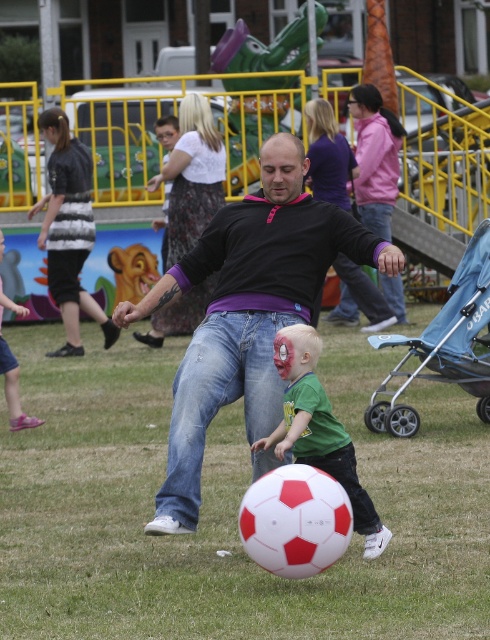
You are standing at the location of the viewer. You want to throw a frisbee to a friend who is standing at the location of the matte black shirt at center. The frisbee can travel up to 8 meters. Will it reach your friend?

The matte black shirt at center and viewer are 7.51 meters apart from each other. Since the frisbee can travel up to 8 meters, it will reach your friend.

You are a photographer trying to capture a photo of the matte black shirt at center and the pink fabric pants at lower left. Which object should you focus on first if you want to ensure both are in focus, given that your camera can only focus on one object at a time?

The matte black shirt at center is above the pink fabric pants at lower left, so you should focus on the matte black shirt at center first to ensure both are in focus.

You are standing at the camera position and want to throw a frisbee to someone near the matte black shirt at center. If the frisbee can travel 8 meters, will it reach them?

The distance between the matte black shirt at center and the camera is 7.51 meters. Since the frisbee can travel 8 meters, it will reach them as 8 meters is greater than 7.51 meters.